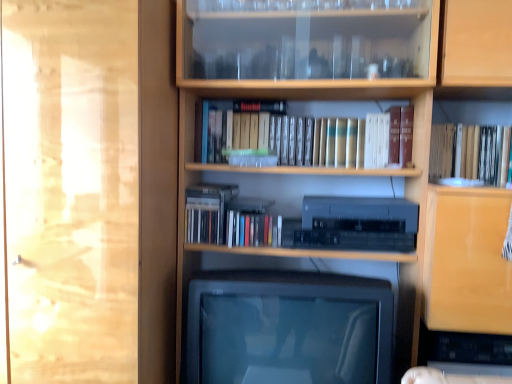
Question: From the image's perspective, would you say wooden bookcase at center is shown under transparent glass door at left?

Choices:
 (A) yes
 (B) no

Answer: (B)

Question: Is wooden bookcase at center closer to the viewer compared to transparent glass door at left?

Choices:
 (A) no
 (B) yes

Answer: (B)

Question: Considering the relative sizes of wooden bookcase at center and transparent glass door at left in the image provided, is wooden bookcase at center bigger than transparent glass door at left?

Choices:
 (A) no
 (B) yes

Answer: (B)

Question: From a real-world perspective, is wooden bookcase at center positioned over transparent glass door at left based on gravity?

Choices:
 (A) no
 (B) yes

Answer: (B)

Question: Is wooden bookcase at center to the right of transparent glass door at left from the viewer's perspective?

Choices:
 (A) no
 (B) yes

Answer: (B)

Question: From a real-world perspective, is satin black stereo at center above or below transparent glass door at left?

Choices:
 (A) above
 (B) below

Answer: (B)

Question: Considering the positions of satin black stereo at center and transparent glass door at left in the image, is satin black stereo at center taller or shorter than transparent glass door at left?

Choices:
 (A) short
 (B) tall

Answer: (A)

Question: Is satin black stereo at center inside the boundaries of transparent glass door at left, or outside?

Choices:
 (A) outside
 (B) inside

Answer: (A)

Question: In terms of size, does satin black stereo at center appear bigger or smaller than transparent glass door at left?

Choices:
 (A) small
 (B) big

Answer: (A)

Question: Is hardcover book at upper right wider or thinner than satin black stereo at center?

Choices:
 (A) wide
 (B) thin

Answer: (B)

Question: Is hardcover book at upper right taller or shorter than satin black stereo at center?

Choices:
 (A) tall
 (B) short

Answer: (A)

Question: Is hardcover book at upper right inside the boundaries of satin black stereo at center, or outside?

Choices:
 (A) inside
 (B) outside

Answer: (B)

Question: From the image's perspective, is hardcover book at upper right located above or below satin black stereo at center?

Choices:
 (A) below
 (B) above

Answer: (B)

Question: Considering the positions of wooden bookcase at center and transparent glass door at left in the image, is wooden bookcase at center taller or shorter than transparent glass door at left?

Choices:
 (A) short
 (B) tall

Answer: (B)

Question: Which is correct: wooden bookcase at center is inside transparent glass door at left, or outside of it?

Choices:
 (A) outside
 (B) inside

Answer: (A)